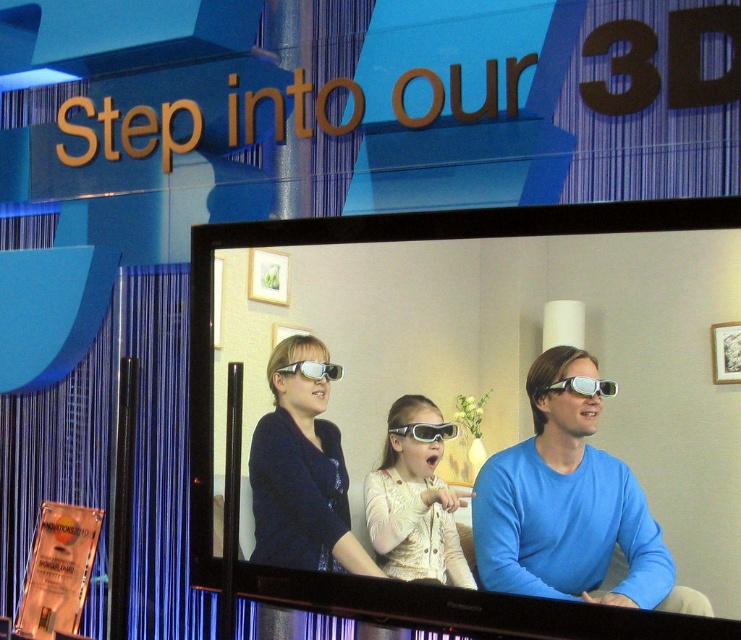
Question: Estimate the real-world distances between objects in this image. Which object is closer to the clear plastic goggles at center?

Choices:
 (A) matte white glasses at center
 (B) matte black sweater at center
 (C) black glossy tv at center
 (D) matte gray goggles at center

Answer: (D)

Question: In this image, where is matte black sweater at center located relative to matte white glasses at center?

Choices:
 (A) right
 (B) left

Answer: (B)

Question: Where is matte black sweater at center located in relation to matte gray goggles at center in the image?

Choices:
 (A) left
 (B) right

Answer: (A)

Question: Which of the following is the closest to the observer?

Choices:
 (A) (379, 506)
 (B) (554, 385)

Answer: (B)

Question: Considering the relative positions of matte white glasses at center and clear plastic goggles at center in the image provided, where is matte white glasses at center located with respect to clear plastic goggles at center?

Choices:
 (A) right
 (B) left

Answer: (B)

Question: Which object appears farthest from the camera in this image?

Choices:
 (A) matte black sweater at center
 (B) blue matte shirt at center

Answer: (A)